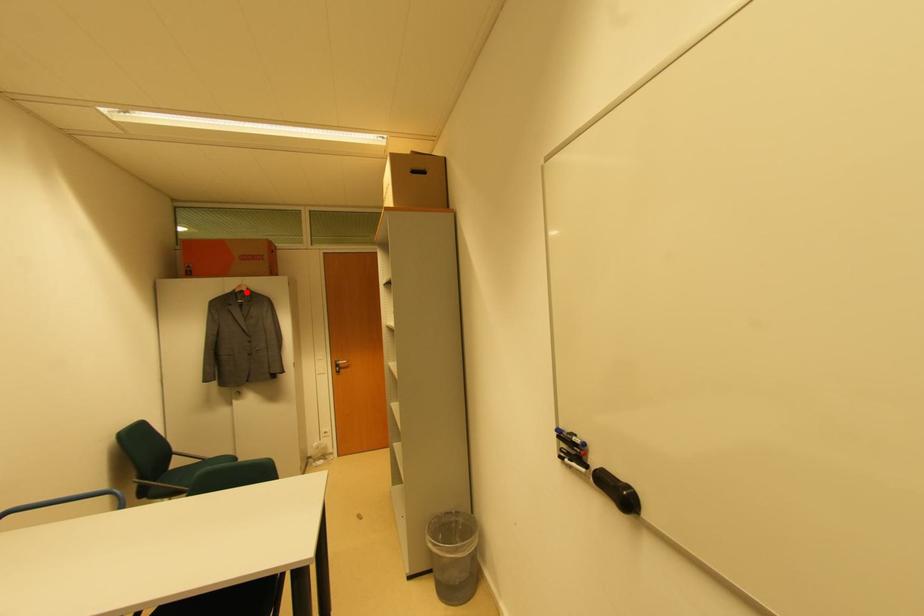
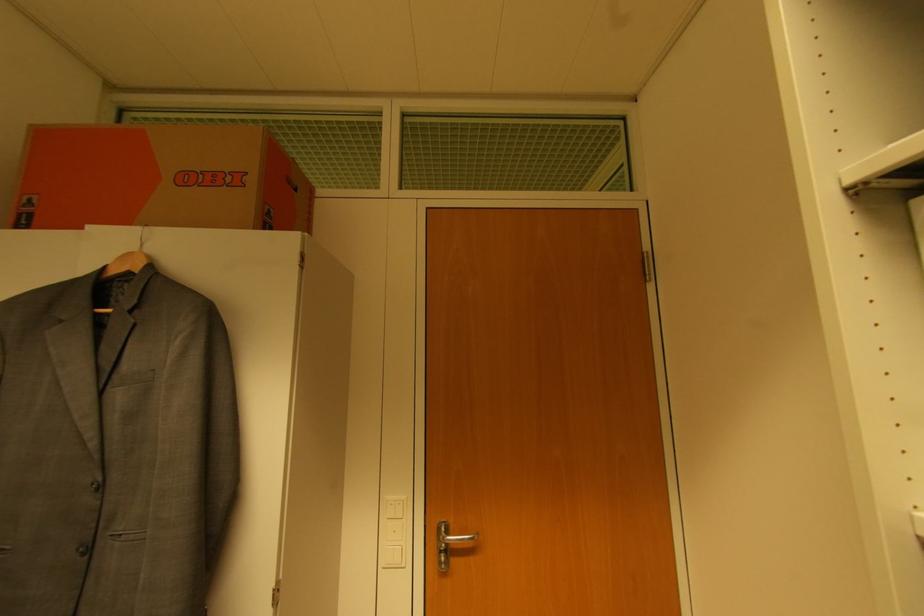
Where in the second image is the point corresponding to the highlighted location from the first image?

(137, 270)